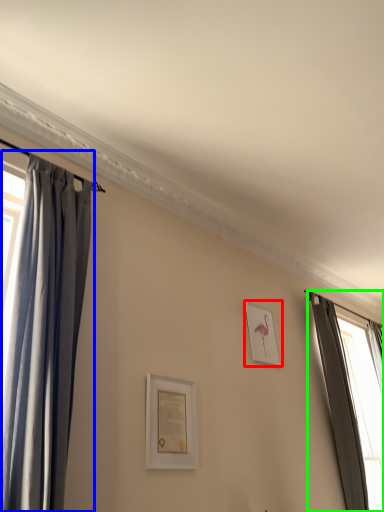
Question: Which object is positioned closest to picture frame (highlighted by a red box)? Select from curtain (highlighted by a blue box) and curtain (highlighted by a green box).

Choices:
 (A) curtain
 (B) curtain

Answer: (A)